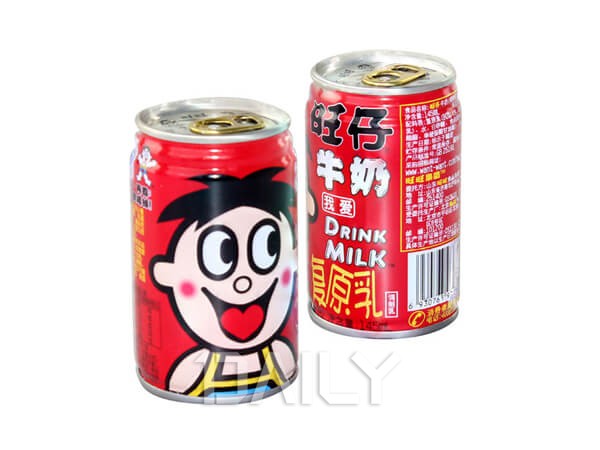
In order to click on tap in this screenshot , I will do `click(392, 77)`, `click(230, 127)`.